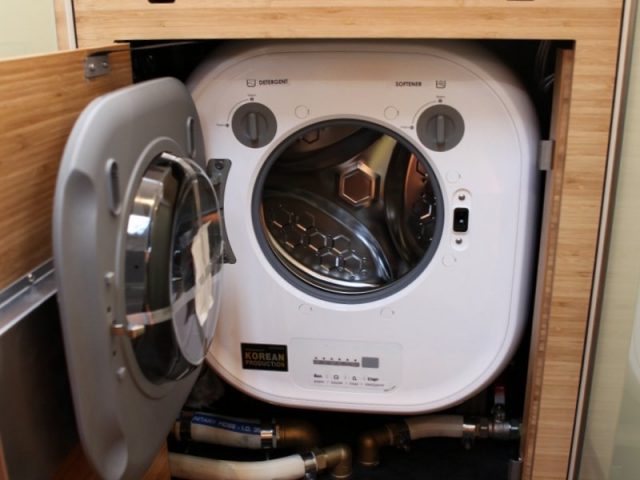
Image resolution: width=640 pixels, height=480 pixels. In order to click on white washing machine in this screenshot , I will do (294, 322), (443, 330), (312, 75).